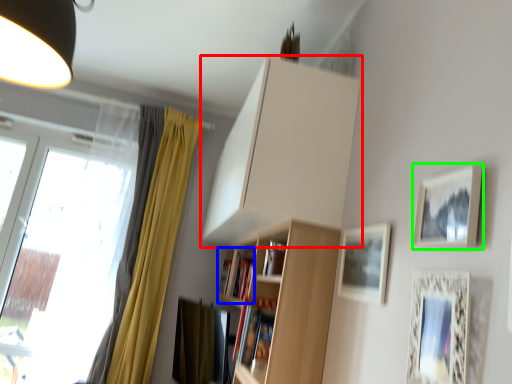
Question: Estimate the real-world distances between objects in this image. Which object is farther from cabinetry (highlighted by a red box), book (highlighted by a blue box) or picture frame (highlighted by a green box)?

Choices:
 (A) book
 (B) picture frame

Answer: (B)